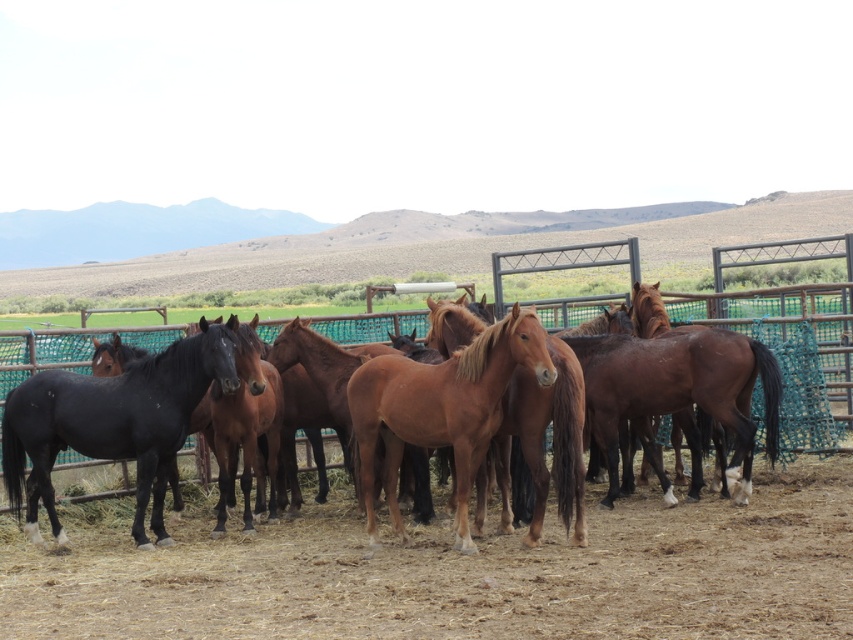
You are a farmer who needs to identify the horses based on their height. You see the shiny brown horse at center and the shiny black horse at left. Which horse is taller?

The shiny black horse at left is taller than the shiny brown horse at center.

Consider the image. You are a farmer checking the enclosure for the shiny brown horse at center and the shiny black horse at left. Which horse is standing closer to the fence?

The shiny brown horse at center is positioned over the shiny black horse at left, meaning it is closer to the fence than the shiny black horse at left.